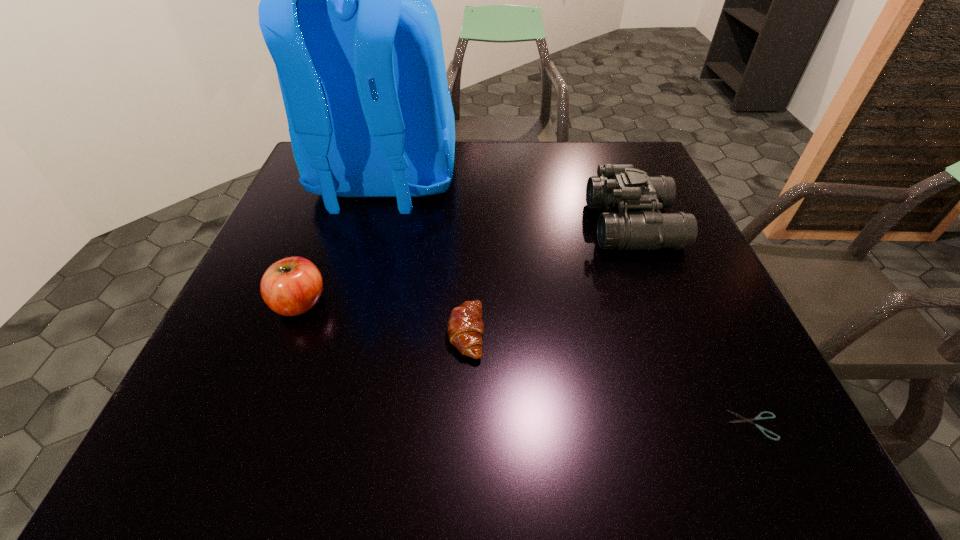
Locate an element on the screen. The image size is (960, 540). backpack is located at coordinates (346, 14).

Where is `the fourth shortest object`? the fourth shortest object is located at coordinates (622, 188).

I want to click on the third shortest object, so click(291, 286).

Identify the location of crescent roll. (465, 327).

Locate an element on the screen. The width and height of the screenshot is (960, 540). the second shortest object is located at coordinates (465, 327).

At what (x,y) coordinates should I click in order to perform the action: click on shears. Please return your answer as a coordinate pair (x, y). This screenshot has width=960, height=540. Looking at the image, I should click on (758, 417).

Locate an element on the screen. The width and height of the screenshot is (960, 540). the nearest object is located at coordinates (758, 417).

Image resolution: width=960 pixels, height=540 pixels. Identify the location of vacant region located 0.060m on the back of the tallest object. 365,253.

Locate an element on the screen. vacant space situated 0.220m through the lenses of the binoculars is located at coordinates (501, 225).

At what (x,y) coordinates should I click in order to perform the action: click on blank space located 0.230m through the lenses of the binoculars. Please return your answer as a coordinate pair (x, y). Looking at the image, I should click on click(496, 225).